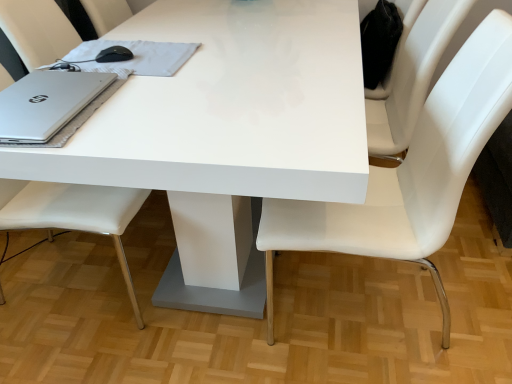
In order to click on free spot to the left of white leather chair at center, which is the second chair in left-to-right order in this screenshot , I will do `click(214, 336)`.